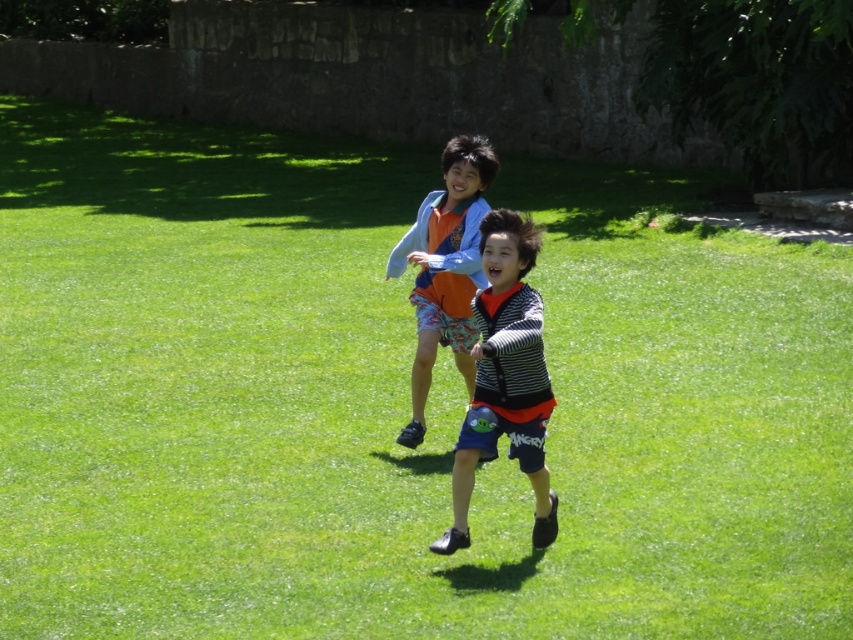
You are a photographer trying to capture both children in a single shot. Based on their positions, which point, point (543, 547) or point (483, 177), is closer to your camera and should be focused on first to ensure both are in clear view?

Point (543, 547) is closer to the camera than point (483, 177), so focusing on it first will help keep both children in clear view.

You are a photographer trying to capture both the striped fabric shirt at center and the orange cotton shirt at center in a single frame. Based on their positions, which shirt would appear closer to the camera?

The striped fabric shirt at center is positioned under the orange cotton shirt at center, so it would appear closer to the camera.

You are a photographer trying to capture both children in a single shot. Since the striped fabric shirt at center and orange cotton shirt at center are both at center, can you adjust your camera angle to ensure both are fully visible without any overlap?

The striped fabric shirt at center is in front of the orange cotton shirt at center, so adjusting the camera angle might allow you to see both by shifting perspective to avoid overlap.